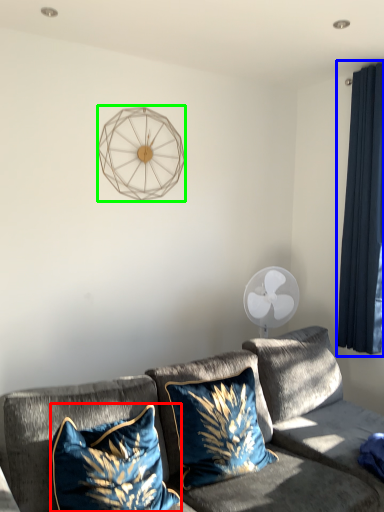
Question: Which object is positioned closest to pillow (highlighted by a red box)? Select from curtain (highlighted by a blue box) and lamp (highlighted by a green box).

Choices:
 (A) curtain
 (B) lamp

Answer: (B)